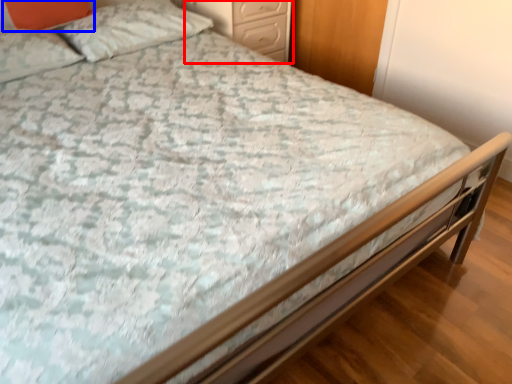
Question: Which object is further to the camera taking this photo, nightstand (highlighted by a red box) or pillow (highlighted by a blue box)?

Choices:
 (A) nightstand
 (B) pillow

Answer: (A)